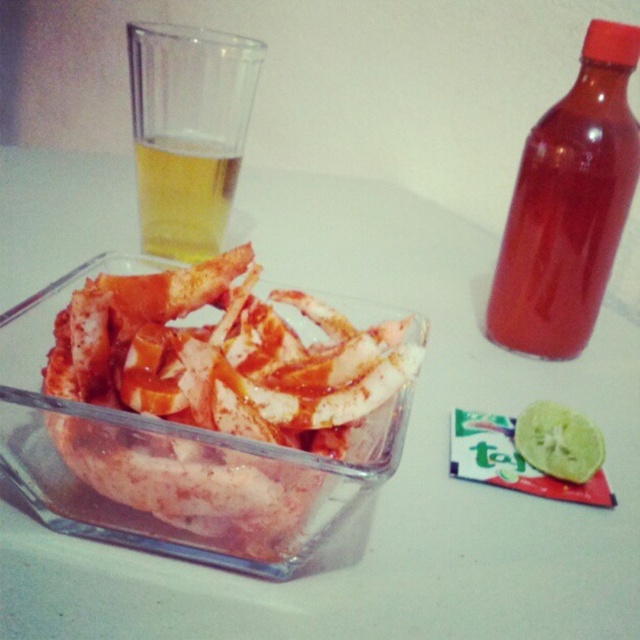
Which is in front, point (486, 314) or point (557, 438)?

Point (557, 438) is in front.

Could you measure the distance between transparent plastic bottle at upper right and green textured lime at lower right?

A distance of 3.64 inches exists between transparent plastic bottle at upper right and green textured lime at lower right.

Locate an element on the screen. The height and width of the screenshot is (640, 640). transparent plastic bottle at upper right is located at coordinates (570, 204).

Can you confirm if translucent plastic cup at upper left is positioned above green textured lime at lower right?

Indeed, translucent plastic cup at upper left is positioned over green textured lime at lower right.

Who is positioned more to the right, translucent plastic cup at upper left or green textured lime at lower right?

From the viewer's perspective, green textured lime at lower right appears more on the right side.

The width and height of the screenshot is (640, 640). I want to click on translucent plastic cup at upper left, so click(188, 131).

The image size is (640, 640). In order to click on translucent plastic cup at upper left in this screenshot , I will do coord(188,131).

Does slightly crispy white chicken at center appear on the left side of green textured lime at lower right?

Indeed, slightly crispy white chicken at center is positioned on the left side of green textured lime at lower right.

The height and width of the screenshot is (640, 640). Describe the element at coordinates (218, 397) in the screenshot. I see `slightly crispy white chicken at center` at that location.

This screenshot has height=640, width=640. What do you see at coordinates (218, 397) in the screenshot?
I see `slightly crispy white chicken at center` at bounding box center [218, 397].

At what (x,y) coordinates should I click in order to perform the action: click on slightly crispy white chicken at center. Please return your answer as a coordinate pair (x, y). The image size is (640, 640). Looking at the image, I should click on [x=218, y=397].